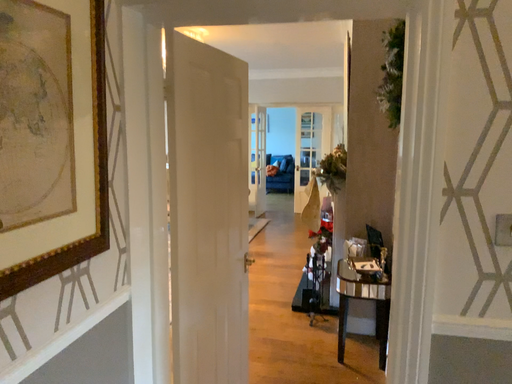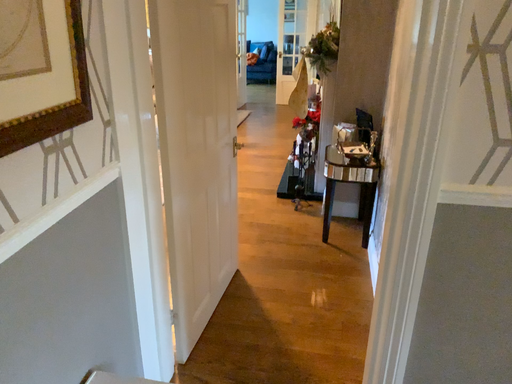
Question: How did the camera likely rotate when shooting the video?

Choices:
 (A) rotated downward
 (B) rotated upward

Answer: (A)